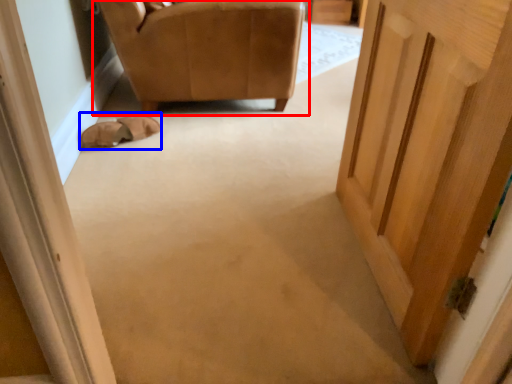
Question: Which point is closer to the camera, chair (highlighted by a red box) or shoe (highlighted by a blue box)?

Choices:
 (A) chair
 (B) shoe

Answer: (A)